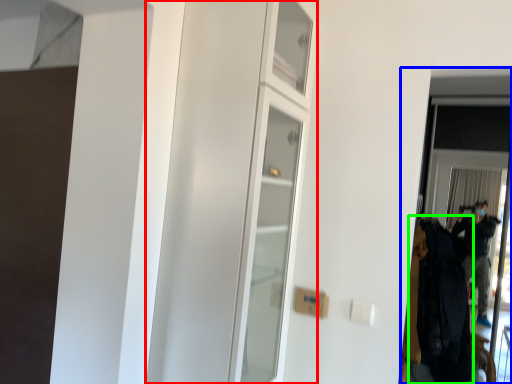
Question: Based on their relative distances, which object is nearer to dresser (highlighted by a red box)? Choose from screen door (highlighted by a blue box) and clothing (highlighted by a green box).

Choices:
 (A) screen door
 (B) clothing

Answer: (B)